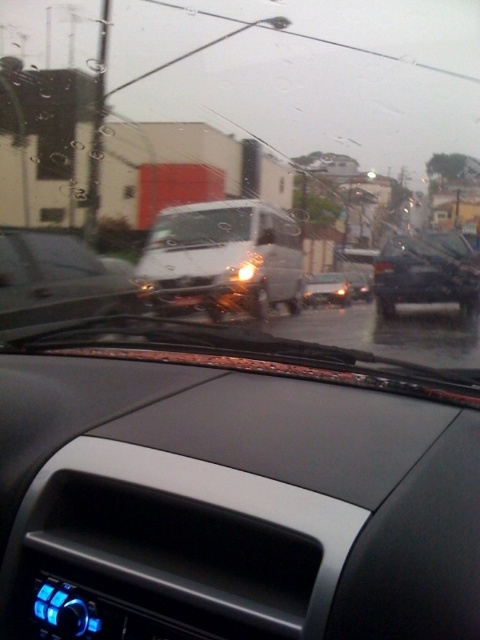
Can you confirm if transparent glass windshield at center is positioned above black matte car at right?

Indeed, transparent glass windshield at center is positioned over black matte car at right.

Measure the distance between point (169,141) and camera.

A distance of 62.70 feet exists between point (169,141) and camera.

The image size is (480, 640). I want to click on transparent glass windshield at center, so click(236, 168).

Is transparent glass windshield at center wider than satin white van at center?

Correct, the width of transparent glass windshield at center exceeds that of satin white van at center.

Who is more distant from viewer, (424, 342) or (204, 305)?

The point (204, 305) is more distant.

Locate an element on the screen. The image size is (480, 640). transparent glass windshield at center is located at coordinates coord(236,168).

Can you confirm if black matte car at right is positioned to the left of glossy white van at center?

In fact, black matte car at right is to the right of glossy white van at center.

Does black matte car at right have a smaller size compared to glossy white van at center?

Actually, black matte car at right might be larger than glossy white van at center.

Which is in front, point (433, 259) or point (336, 285)?

Positioned in front is point (433, 259).

What are the coordinates of `black matte car at right` in the screenshot? It's located at (427, 273).